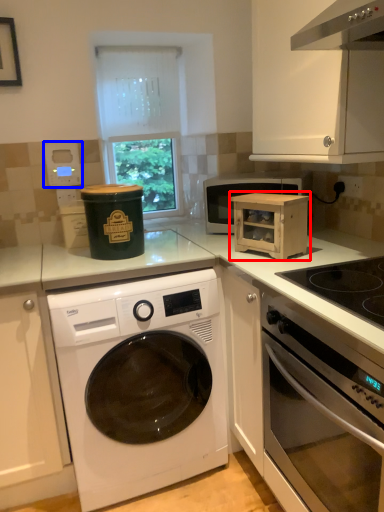
Question: Among these objects, which one is farthest to the camera, cardboard box (highlighted by a red box) or appliance (highlighted by a blue box)?

Choices:
 (A) cardboard box
 (B) appliance

Answer: (B)